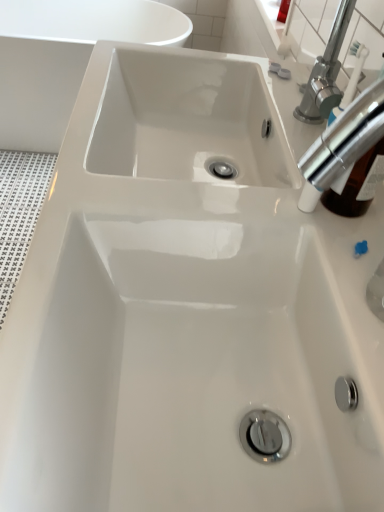
The height and width of the screenshot is (512, 384). Find the location of `free location in front of chrome metallic tap at upper right`. free location in front of chrome metallic tap at upper right is located at coordinates (348, 297).